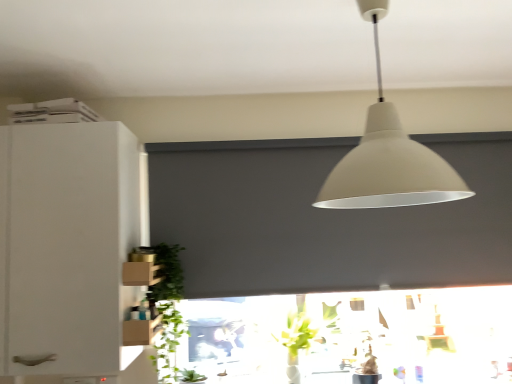
Question: Does white matte cabinet at left have a larger size compared to green leafy plant at lower left?

Choices:
 (A) no
 (B) yes

Answer: (B)

Question: Considering the relative sizes of white matte cabinet at left and green leafy plant at lower left in the image provided, is white matte cabinet at left taller than green leafy plant at lower left?

Choices:
 (A) yes
 (B) no

Answer: (A)

Question: Can you confirm if white matte cabinet at left is shorter than green leafy plant at lower left?

Choices:
 (A) no
 (B) yes

Answer: (A)

Question: Is white matte cabinet at left far away from green leafy plant at lower left?

Choices:
 (A) yes
 (B) no

Answer: (B)

Question: From a real-world perspective, is white matte cabinet at left below green leafy plant at lower left?

Choices:
 (A) no
 (B) yes

Answer: (A)

Question: Is white matte cabinet at left wider or thinner than matte gray window screen at center?

Choices:
 (A) wide
 (B) thin

Answer: (A)

Question: Is white matte cabinet at left spatially inside matte gray window screen at center, or outside of it?

Choices:
 (A) outside
 (B) inside

Answer: (A)

Question: Based on their positions, is white matte cabinet at left located to the left or right of matte gray window screen at center?

Choices:
 (A) right
 (B) left

Answer: (B)

Question: Does point (3, 218) appear closer or farther from the camera than point (394, 249)?

Choices:
 (A) closer
 (B) farther

Answer: (A)

Question: Is white matte cabinet at left situated inside matte white lampshade at upper center or outside?

Choices:
 (A) outside
 (B) inside

Answer: (A)

Question: From the image's perspective, is white matte cabinet at left located above or below matte white lampshade at upper center?

Choices:
 (A) above
 (B) below

Answer: (B)

Question: Relative to matte white lampshade at upper center, is white matte cabinet at left in front or behind?

Choices:
 (A) behind
 (B) front

Answer: (A)

Question: Would you say white matte cabinet at left is to the left or to the right of matte white lampshade at upper center in the picture?

Choices:
 (A) left
 (B) right

Answer: (A)

Question: In terms of width, does white matte cabinet at left look wider or thinner when compared to green leafy plant at lower left?

Choices:
 (A) thin
 (B) wide

Answer: (B)

Question: Is white matte cabinet at left to the left or to the right of green leafy plant at lower left in the image?

Choices:
 (A) right
 (B) left

Answer: (B)